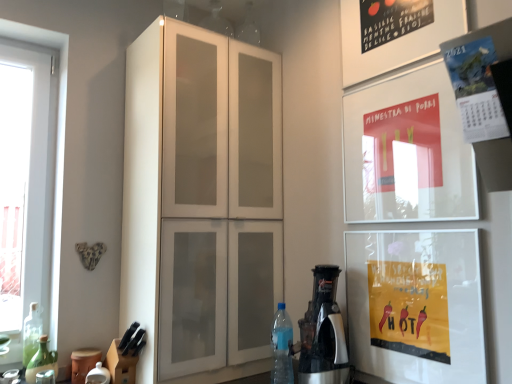
Question: In terms of width, does blue translucent bottle at lower right, the 3th bottle viewed from the left, look wider or thinner when compared to green glass bottle at lower left, the 3th bottle positioned from the right?

Choices:
 (A) thin
 (B) wide

Answer: (B)

Question: From their relative heights in the image, would you say blue translucent bottle at lower right, the 3th bottle viewed from the left, is taller or shorter than green glass bottle at lower left, the 3th bottle positioned from the right?

Choices:
 (A) short
 (B) tall

Answer: (A)

Question: Which is farther from the matte paper calendar at upper right, the second poster from the back?

Choices:
 (A) white glass window at left
 (B) white matte cabinet at center
 (C) green glass bottle at left, the second bottle when ordered from right to left
 (D) blue translucent bottle at lower right, which appears as the 1th bottle when viewed from the right
 (E) matte paper poster at upper right, the 1th poster from the back

Answer: (C)

Question: Considering the real-world distances, which object is closest to the silver metallic coffee machine at lower right?

Choices:
 (A) green glass bottle at left, the 2th bottle when ordered from left to right
 (B) white matte cabinet at center
 (C) white glass window at left
 (D) green glass bottle at lower left, the first bottle positioned from the left
 (E) matte paper poster at upper right, which ranks as the second poster in front-to-back order

Answer: (E)